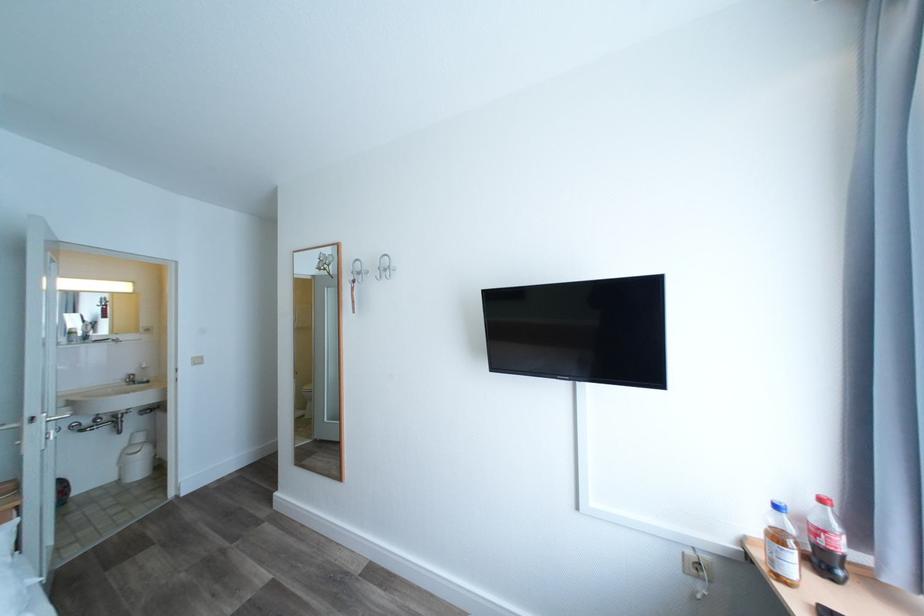
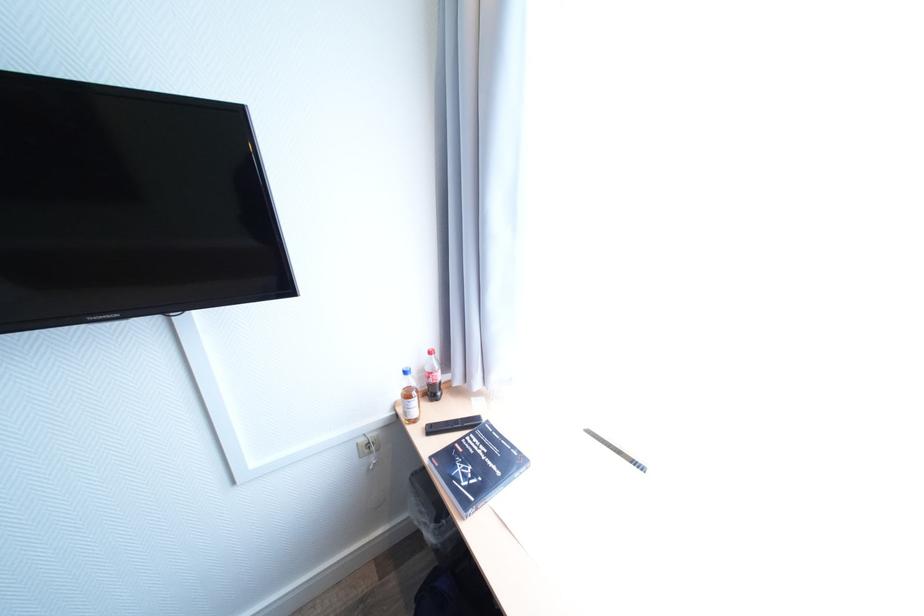
The point at (690,554) is marked in the first image. Where is the corresponding point in the second image?

(365, 445)